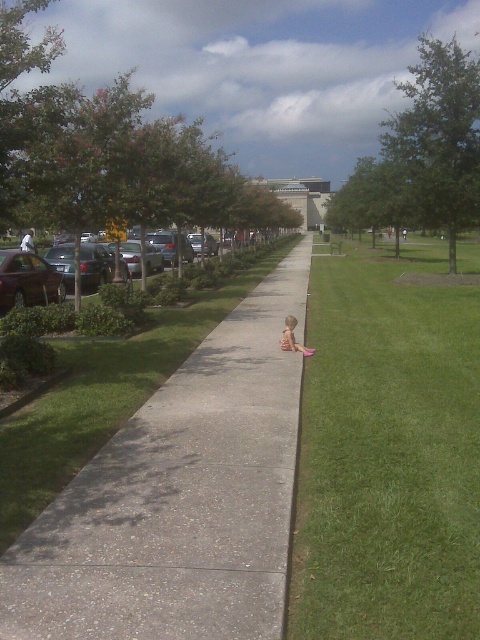
Between green grass at center and light brown wooden chair at center, which one appears on the left side from the viewer's perspective?

Positioned to the left is light brown wooden chair at center.

Does green grass at center appear on the right side of light brown wooden chair at center?

Yes, green grass at center is to the right of light brown wooden chair at center.

Image resolution: width=480 pixels, height=640 pixels. Describe the element at coordinates (387, 452) in the screenshot. I see `green grass at center` at that location.

Image resolution: width=480 pixels, height=640 pixels. What are the coordinates of `green grass at center` in the screenshot? It's located at (387, 452).

Can you confirm if gray concrete sidewalk at center is positioned above green grass at center?

No, gray concrete sidewalk at center is not above green grass at center.

Is gray concrete sidewalk at center positioned at the back of green grass at center?

No, it is in front of green grass at center.

Identify the location of gray concrete sidewalk at center. The width and height of the screenshot is (480, 640). (180, 499).

Consider the image. Is green grass at center positioned behind concrete at center?

That is False.

Does green grass at center appear on the right side of concrete at center?

Correct, you'll find green grass at center to the right of concrete at center.

Does point (343, 465) come closer to viewer compared to point (304, 333)?

Yes, point (343, 465) is closer to viewer.

I want to click on green grass at center, so click(x=387, y=452).